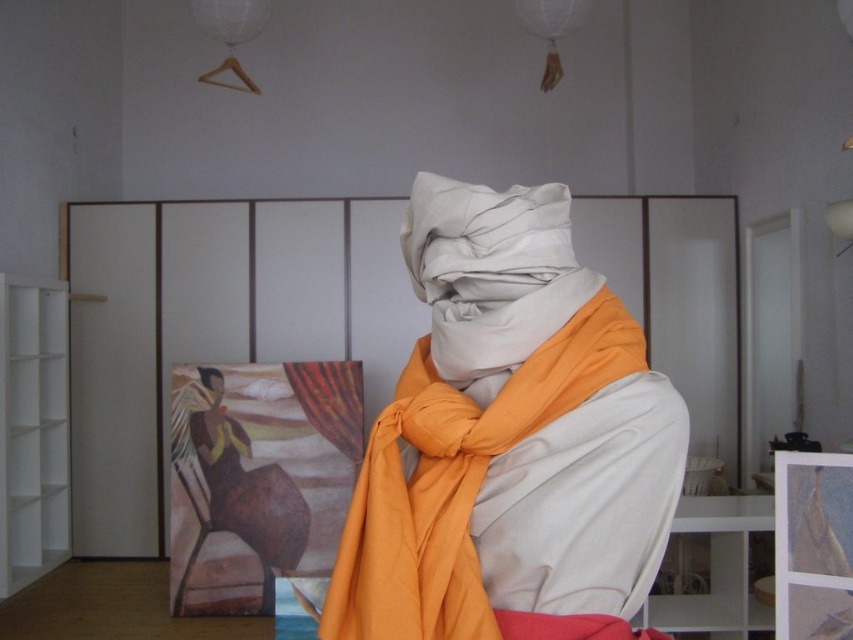
Does point (556, 385) come farther from viewer compared to point (213, 376)?

No, (556, 385) is closer to viewer.

Who is taller, matte white scarf at center or matte orange scarf at center?

matte white scarf at center is taller.

Is point (630, 493) behind point (196, 365)?

That is False.

Where is `matte white scarf at center`? This screenshot has width=853, height=640. matte white scarf at center is located at coordinates (473, 410).